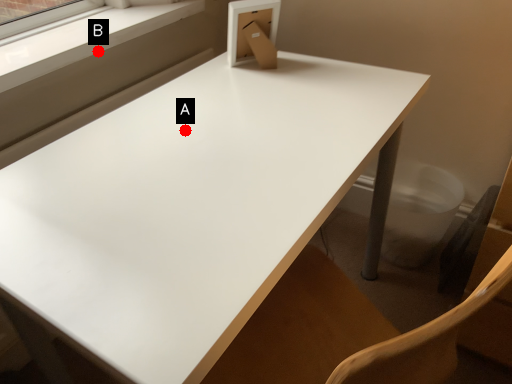
Question: Two points are circled on the image, labeled by A and B beside each circle. Which point is farther to the camera?

Choices:
 (A) A is further
 (B) B is further

Answer: (B)